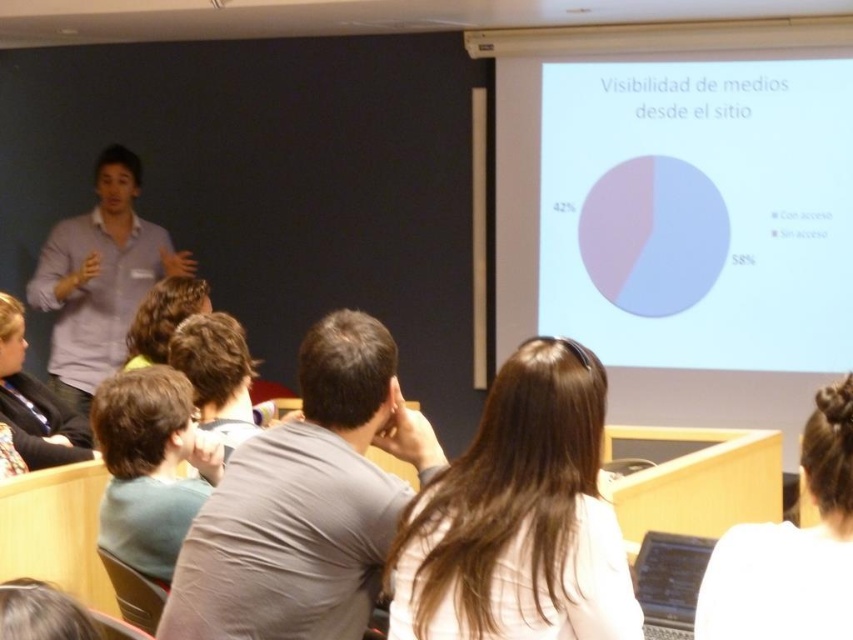
You are a student sitting in the classroom and you notice two people in the front. One has light brown hair at center and the other has white hair at upper right. Which person is more to the left?

The light brown hair at center is more to the left than the white hair at upper right.